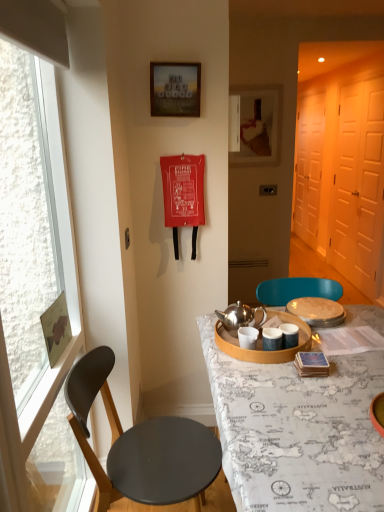
Question: Does white matte screen door at right, the 1th screen door when ordered from back to front, lie behind wooden picture frame at upper center, the second picture frame in the front-to-back sequence?

Choices:
 (A) yes
 (B) no

Answer: (A)

Question: Is white matte screen door at right, the 1th screen door when ordered from back to front, with wooden picture frame at upper center, which is counted as the 1th picture frame, starting from the right?

Choices:
 (A) yes
 (B) no

Answer: (B)

Question: Can you confirm if white matte screen door at right, the 1th screen door when ordered from back to front, is wider than wooden picture frame at upper center, the second picture frame in the front-to-back sequence?

Choices:
 (A) no
 (B) yes

Answer: (B)

Question: Considering the relative sizes of white matte screen door at right, the 1th screen door when ordered from back to front, and wooden picture frame at upper center, the second picture frame in the front-to-back sequence, in the image provided, is white matte screen door at right, the 1th screen door when ordered from back to front, bigger than wooden picture frame at upper center, the second picture frame in the front-to-back sequence,?

Choices:
 (A) yes
 (B) no

Answer: (A)

Question: Is the depth of white matte screen door at right, placed as the 2th screen door when sorted from front to back, less than that of wooden picture frame at upper center, which is counted as the 1th picture frame, starting from the right?

Choices:
 (A) no
 (B) yes

Answer: (A)

Question: In the image, is matte silver tray at center, which ranks as the 1th tableware in right-to-left order, positioned in front of or behind white matte screen door at right, placed as the 2th screen door when sorted from front to back?

Choices:
 (A) behind
 (B) front

Answer: (B)

Question: From a real-world perspective, is matte silver tray at center, which is the 2th tableware in left-to-right order, above or below white matte screen door at right, placed as the 2th screen door when sorted from front to back?

Choices:
 (A) above
 (B) below

Answer: (B)

Question: Considering the positions of matte silver tray at center, which ranks as the 1th tableware in right-to-left order, and white matte screen door at right, the 1th screen door when ordered from back to front, in the image, is matte silver tray at center, which ranks as the 1th tableware in right-to-left order, taller or shorter than white matte screen door at right, the 1th screen door when ordered from back to front,?

Choices:
 (A) short
 (B) tall

Answer: (A)

Question: Which is correct: matte silver tray at center, which ranks as the 1th tableware in right-to-left order, is inside white matte screen door at right, placed as the 2th screen door when sorted from front to back, or outside of it?

Choices:
 (A) outside
 (B) inside

Answer: (A)

Question: Is wooden picture frame at upper center, which is counted as the 1th picture frame, starting from the right, inside the boundaries of wooden frame at upper center, the 2th picture frame in the right-to-left sequence, or outside?

Choices:
 (A) outside
 (B) inside

Answer: (A)

Question: From a real-world perspective, is wooden picture frame at upper center, the second picture frame in the front-to-back sequence, physically located above or below wooden frame at upper center, the second picture frame from the back?

Choices:
 (A) above
 (B) below

Answer: (B)

Question: From the image's perspective, is wooden picture frame at upper center, the second picture frame in the front-to-back sequence, positioned above or below wooden frame at upper center, the 1th picture frame in the left-to-right sequence?

Choices:
 (A) below
 (B) above

Answer: (B)

Question: Considering the positions of point (243, 157) and point (150, 83), is point (243, 157) closer or farther from the camera than point (150, 83)?

Choices:
 (A) farther
 (B) closer

Answer: (A)

Question: In the image, is map-covered table at center positioned in front of or behind black matte chair at left?

Choices:
 (A) behind
 (B) front

Answer: (B)

Question: Is point (238, 408) closer or farther from the camera than point (130, 435)?

Choices:
 (A) farther
 (B) closer

Answer: (B)